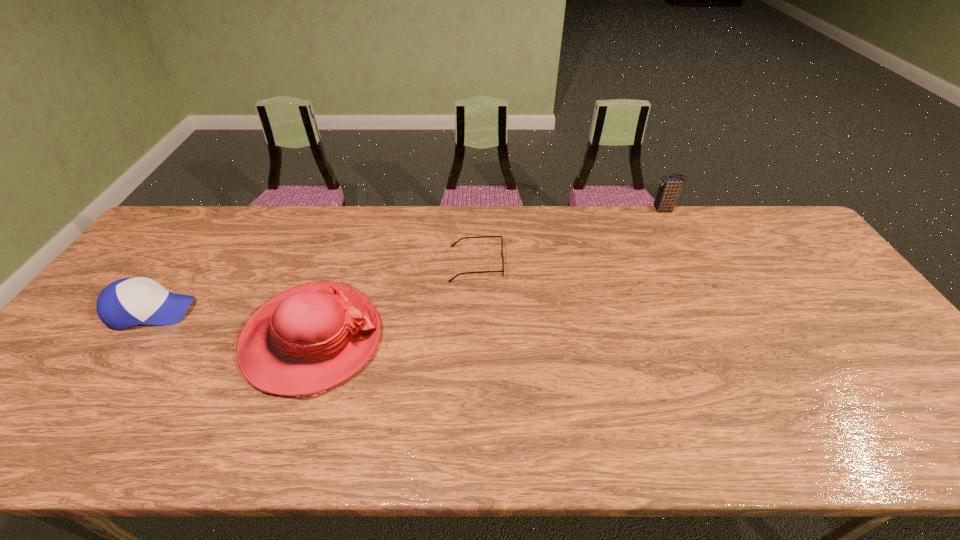
This screenshot has width=960, height=540. Find the location of `unoccupied area between the rightmost object and the shortest object`. unoccupied area between the rightmost object and the shortest object is located at coordinates (570, 237).

Where is `unoccupied area between the third tallest object and the third object from right to left`? unoccupied area between the third tallest object and the third object from right to left is located at coordinates (232, 325).

This screenshot has height=540, width=960. I want to click on the second closest object to the hat, so click(127, 302).

Locate which object ranks in proximity to the second object from left to right. Please provide its 2D coordinates. Your answer should be formatted as a tuple, i.e. [(x, y)], where the tuple contains the x and y coordinates of a point satisfying the conditions above.

[(452, 245)]